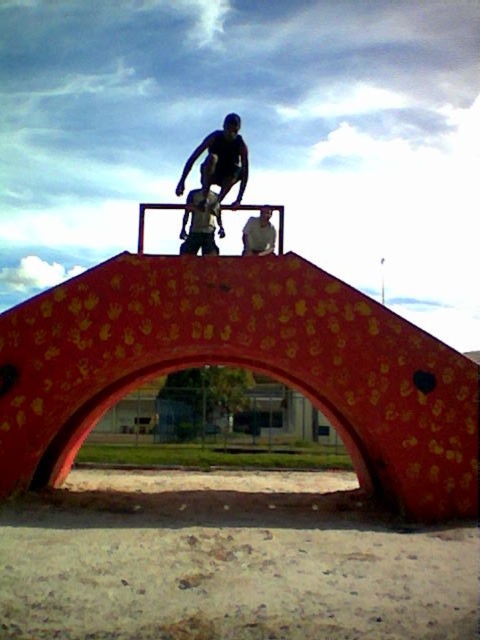
You are a photographer positioned at the origin point of the coordinate system. You want to capture a photo of the matte black skateboarder at center. What are the coordinates where you should aim your camera?

The coordinates to aim the camera are at point (219, 161) to capture the matte black skateboarder at center.

You are standing in front of the red archway and want to place a new sign on the side of the archway. The sign needs to be placed to the left of the shiny black skateboard at center. Where should the sign be positioned relative to the matte black skateboarder at center?

The sign should be placed to the left of the shiny black skateboard at center, which would position it to the left of the matte black skateboarder at center since the matte black skateboarder at center is to the right of the shiny black skateboard at center.